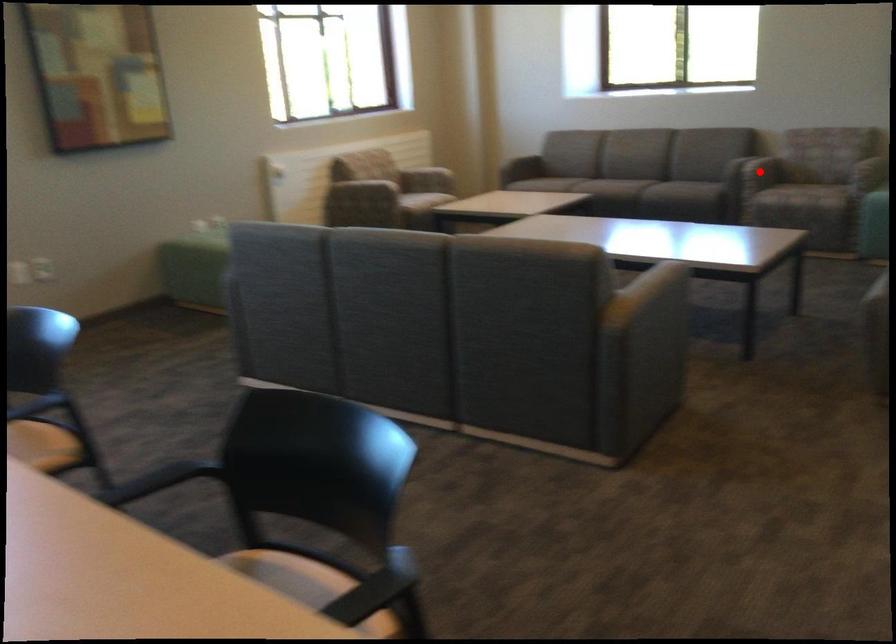
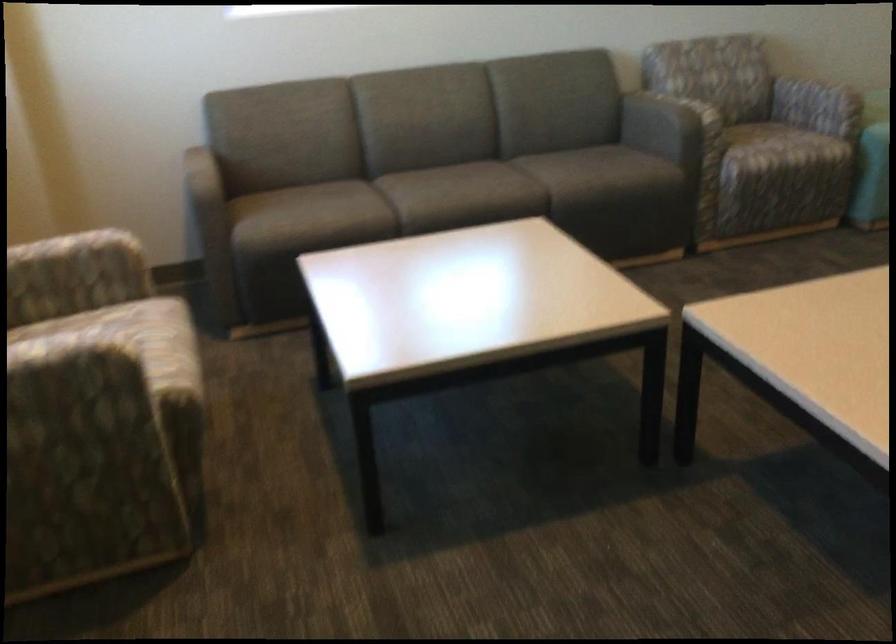
Question: I am providing you with two images of the same scene from different viewpoints. A red point is marked on the first image. Can you still see the location of the red point in image 2?

Choices:
 (A) Yes
 (B) No

Answer: (B)